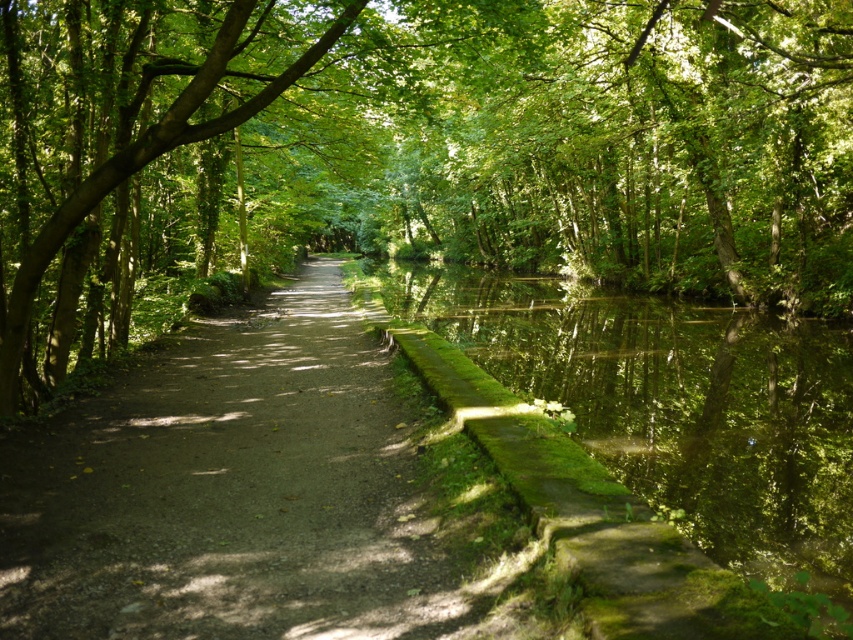
Is green leafy tree at center taller than dirt path at center?

Yes, green leafy tree at center is taller than dirt path at center.

Does green leafy tree at center appear on the left side of dirt path at center?

Incorrect, green leafy tree at center is not on the left side of dirt path at center.

Where is `green leafy tree at center`? This screenshot has width=853, height=640. green leafy tree at center is located at coordinates (412, 150).